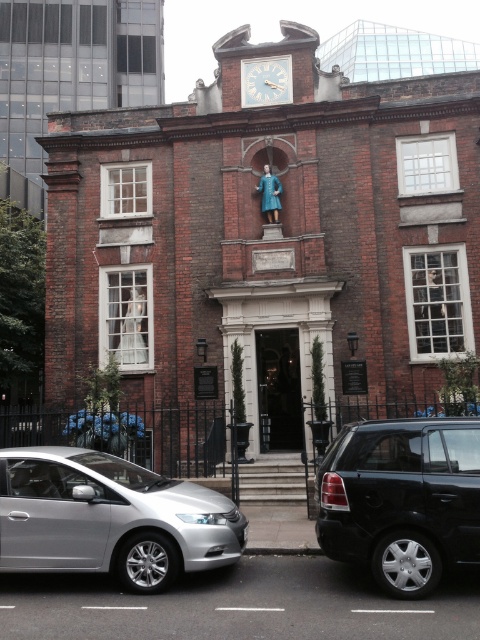
Which of these two, silver metallic car at lower left or white wooden clock at upper center, stands taller?

white wooden clock at upper center is taller.

Is silver metallic car at lower left to the right of white wooden clock at upper center from the viewer's perspective?

Incorrect, silver metallic car at lower left is not on the right side of white wooden clock at upper center.

Which is in front, point (72, 550) or point (247, 99)?

Point (72, 550) is in front.

Locate an element on the screen. This screenshot has height=640, width=480. silver metallic car at lower left is located at coordinates (109, 518).

Does point (100, 557) lie behind point (356, 451)?

No, it is in front of (356, 451).

Is silver metallic car at lower left below black matte suv at lower right?

Correct, silver metallic car at lower left is located below black matte suv at lower right.

Between point (12, 566) and point (343, 456), which one is positioned in front?

Point (12, 566) is in front.

This screenshot has height=640, width=480. I want to click on silver metallic car at lower left, so click(x=109, y=518).

Can you confirm if black matte suv at lower right is smaller than white wooden clock at upper center?

No.

Between point (468, 556) and point (286, 65), which one is positioned behind?

The point (286, 65) is behind.

Is point (348, 458) positioned in front of point (275, 76)?

Yes, point (348, 458) is closer to viewer.

The height and width of the screenshot is (640, 480). I want to click on black matte suv at lower right, so click(402, 499).